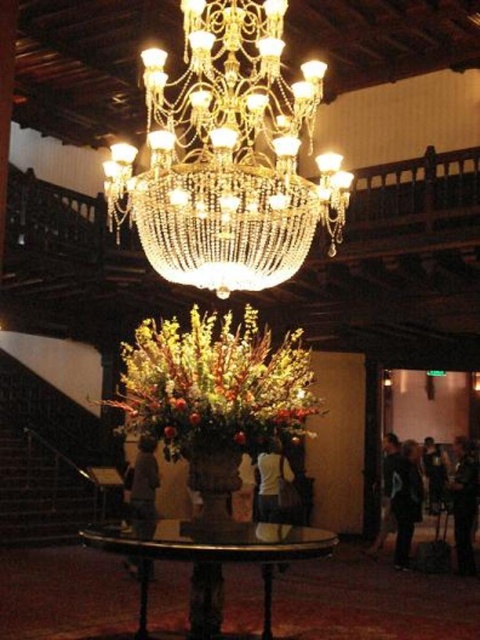
In the scene shown: Who is taller, white matte shirt at center or dark blue fabric at lower right?

With more height is dark blue fabric at lower right.

The height and width of the screenshot is (640, 480). What do you see at coordinates (273, 481) in the screenshot? I see `white matte shirt at center` at bounding box center [273, 481].

This screenshot has height=640, width=480. What are the coordinates of `white matte shirt at center` in the screenshot? It's located at (273, 481).

Is point (163, 541) positioned in front of point (272, 497)?

Yes, point (163, 541) is in front of point (272, 497).

Which is in front, point (255, 538) or point (265, 452)?

Point (255, 538)

You are a GUI agent. You are given a task and a screenshot of the screen. Output one action in this format:
    pyautogui.click(x=<x>, y=<y>)
    Task: Click on the glass/metallic table at center
    The height and width of the screenshot is (640, 480).
    Given the screenshot: What is the action you would take?
    pyautogui.click(x=215, y=563)

Which is above, glass/metallic table at center or light brown leather jacket at center?

glass/metallic table at center is above.

I want to click on glass/metallic table at center, so click(215, 563).

The image size is (480, 640). What are the coordinates of `glass/metallic table at center` in the screenshot? It's located at (215, 563).